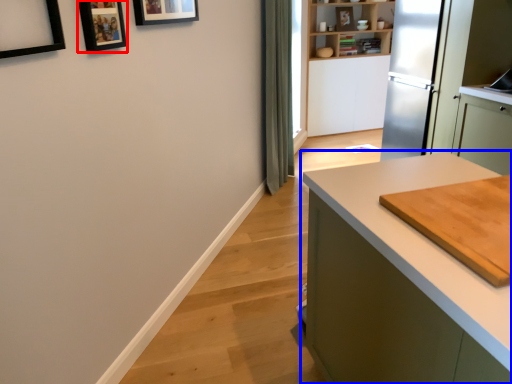
Question: Among these objects, which one is nearest to the camera, picture frame (highlighted by a red box) or countertop (highlighted by a blue box)?

Choices:
 (A) picture frame
 (B) countertop

Answer: (B)